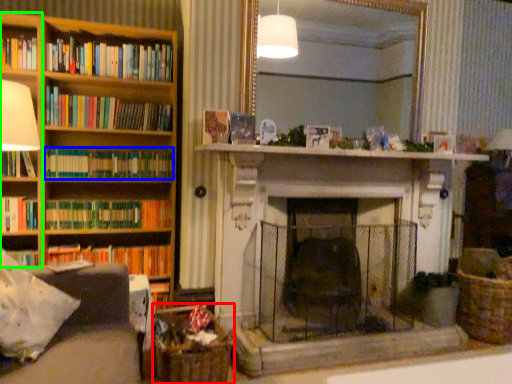
Question: Which is nearer to the basket (highlighted by a red box)? book (highlighted by a blue box) or shelf (highlighted by a green box).

Choices:
 (A) book
 (B) shelf

Answer: (A)